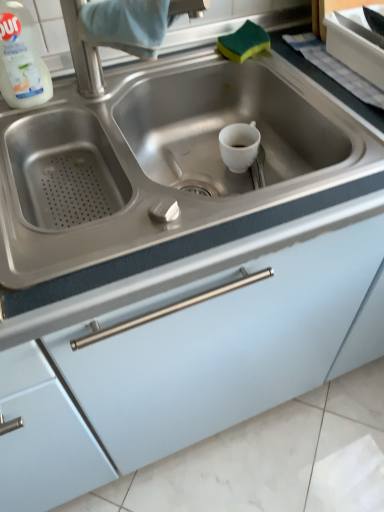
Question: From the image's perspective, does stainless steel sink at center appear lower than stainless steel faucet at upper center?

Choices:
 (A) no
 (B) yes

Answer: (B)

Question: Does stainless steel sink at center have a smaller size compared to stainless steel faucet at upper center?

Choices:
 (A) no
 (B) yes

Answer: (A)

Question: Can we say stainless steel sink at center lies outside stainless steel faucet at upper center?

Choices:
 (A) yes
 (B) no

Answer: (A)

Question: From a real-world perspective, is stainless steel sink at center below stainless steel faucet at upper center?

Choices:
 (A) no
 (B) yes

Answer: (B)

Question: From the image's perspective, would you say stainless steel sink at center is positioned over stainless steel faucet at upper center?

Choices:
 (A) no
 (B) yes

Answer: (A)

Question: From a real-world perspective, is white plastic bottle at upper left physically located above or below stainless steel sink at center?

Choices:
 (A) above
 (B) below

Answer: (A)

Question: Would you say white plastic bottle at upper left is inside or outside stainless steel sink at center?

Choices:
 (A) inside
 (B) outside

Answer: (B)

Question: Considering the positions of white plastic bottle at upper left and stainless steel sink at center in the image, is white plastic bottle at upper left bigger or smaller than stainless steel sink at center?

Choices:
 (A) big
 (B) small

Answer: (B)

Question: Considering their positions, is white plastic bottle at upper left located in front of or behind stainless steel sink at center?

Choices:
 (A) front
 (B) behind

Answer: (B)

Question: Is stainless steel faucet at upper center inside or outside of white plastic bottle at upper left?

Choices:
 (A) inside
 (B) outside

Answer: (B)

Question: Considering the positions of stainless steel faucet at upper center and white plastic bottle at upper left in the image, is stainless steel faucet at upper center wider or thinner than white plastic bottle at upper left?

Choices:
 (A) thin
 (B) wide

Answer: (B)

Question: Would you say stainless steel faucet at upper center is to the left or to the right of white plastic bottle at upper left in the picture?

Choices:
 (A) right
 (B) left

Answer: (A)

Question: In the image, is stainless steel faucet at upper center positioned in front of or behind white plastic bottle at upper left?

Choices:
 (A) front
 (B) behind

Answer: (A)

Question: From a real-world perspective, is stainless steel faucet at upper center above or below matte white cabinet at center?

Choices:
 (A) above
 (B) below

Answer: (A)

Question: In the image, is stainless steel faucet at upper center positioned in front of or behind matte white cabinet at center?

Choices:
 (A) front
 (B) behind

Answer: (B)